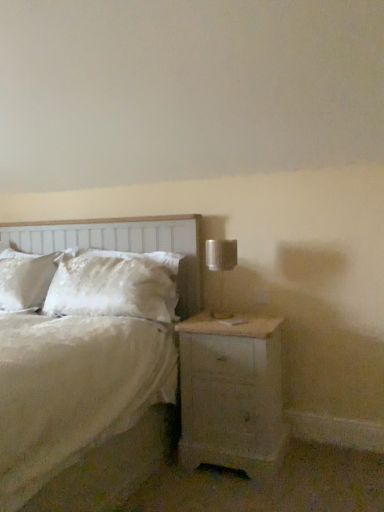
Locate an element on the screen. Image resolution: width=384 pixels, height=512 pixels. free space in front of metallic silver table lamp at right is located at coordinates (233, 322).